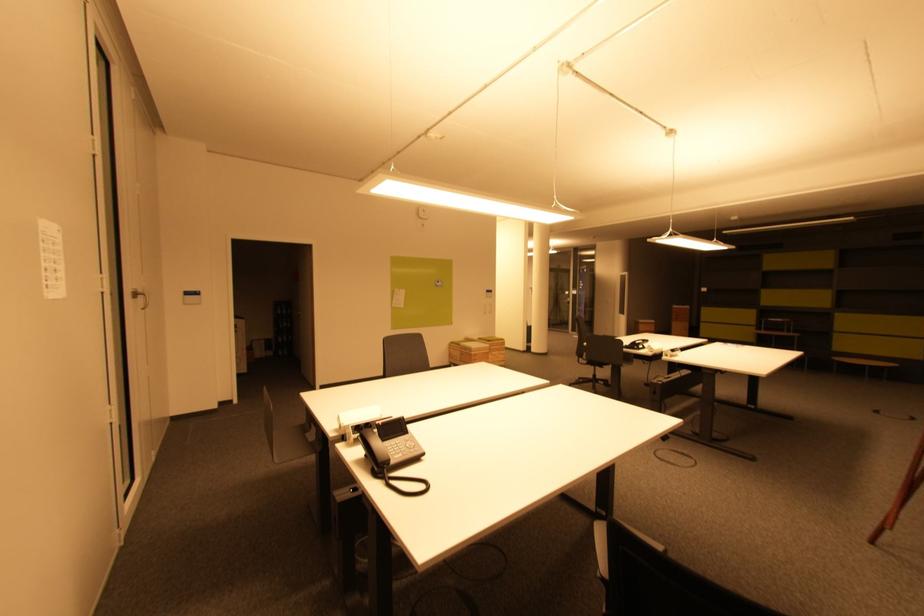
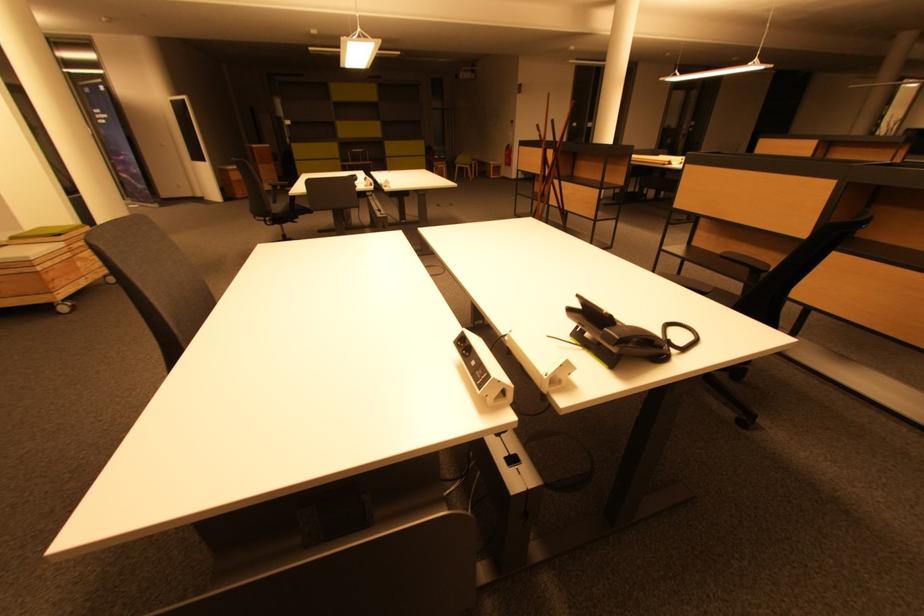
Locate, in the second image, the point that corresponds to (x=494, y=359) in the first image.

(83, 265)